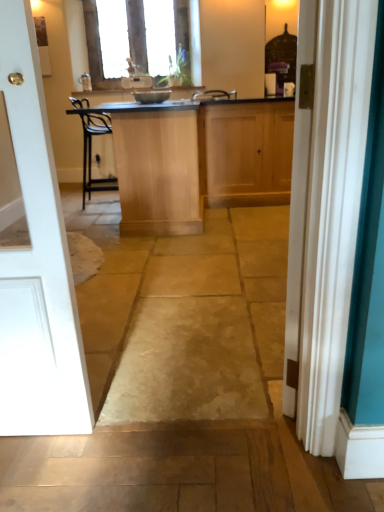
Question: Is wooden cabinet at center, which is counted as the 1th cabinetry, starting from the right, outside of light wood/finely finished cabinet at center, placed as the second cabinetry when sorted from right to left?

Choices:
 (A) no
 (B) yes

Answer: (B)

Question: Does wooden cabinet at center, marked as the 2th cabinetry in a left-to-right arrangement, appear on the left side of light wood/finely finished cabinet at center, placed as the second cabinetry when sorted from right to left?

Choices:
 (A) no
 (B) yes

Answer: (A)

Question: Does wooden cabinet at center, marked as the 2th cabinetry in a left-to-right arrangement, have a smaller size compared to light wood/finely finished cabinet at center, placed as the second cabinetry when sorted from right to left?

Choices:
 (A) no
 (B) yes

Answer: (B)

Question: Can you see wooden cabinet at center, marked as the 2th cabinetry in a left-to-right arrangement, touching light wood/finely finished cabinet at center, placed as the second cabinetry when sorted from right to left?

Choices:
 (A) yes
 (B) no

Answer: (B)

Question: From the image's perspective, is wooden cabinet at center, marked as the 2th cabinetry in a left-to-right arrangement, below light wood/finely finished cabinet at center, placed as the second cabinetry when sorted from right to left?

Choices:
 (A) yes
 (B) no

Answer: (B)

Question: From a real-world perspective, relative to white painted wood door at left, is wooden cabinet at center, which is counted as the 1th cabinetry, starting from the right, vertically above or below?

Choices:
 (A) above
 (B) below

Answer: (B)

Question: From the image's perspective, is wooden cabinet at center, marked as the 2th cabinetry in a left-to-right arrangement, located above or below white painted wood door at left?

Choices:
 (A) above
 (B) below

Answer: (A)

Question: Considering the positions of wooden cabinet at center, which is counted as the 1th cabinetry, starting from the right, and white painted wood door at left in the image, is wooden cabinet at center, which is counted as the 1th cabinetry, starting from the right, wider or thinner than white painted wood door at left?

Choices:
 (A) wide
 (B) thin

Answer: (A)

Question: Based on their positions, is wooden cabinet at center, marked as the 2th cabinetry in a left-to-right arrangement, located to the left or right of white painted wood door at left?

Choices:
 (A) right
 (B) left

Answer: (A)

Question: Would you say light wood/finely finished cabinet at center, the first cabinetry from the left, is inside or outside teal fabric curtain at right?

Choices:
 (A) outside
 (B) inside

Answer: (A)

Question: From a real-world perspective, relative to teal fabric curtain at right, is light wood/finely finished cabinet at center, the first cabinetry from the left, vertically above or below?

Choices:
 (A) above
 (B) below

Answer: (B)

Question: In the image, is light wood/finely finished cabinet at center, the first cabinetry from the left, positioned in front of or behind teal fabric curtain at right?

Choices:
 (A) behind
 (B) front

Answer: (A)

Question: Looking at their shapes, would you say light wood/finely finished cabinet at center, the first cabinetry from the left, is wider or thinner than teal fabric curtain at right?

Choices:
 (A) wide
 (B) thin

Answer: (A)

Question: Do you think metallic silver bowl at center is within white painted wood door at left, or outside of it?

Choices:
 (A) outside
 (B) inside

Answer: (A)

Question: In terms of size, does metallic silver bowl at center appear bigger or smaller than white painted wood door at left?

Choices:
 (A) big
 (B) small

Answer: (B)